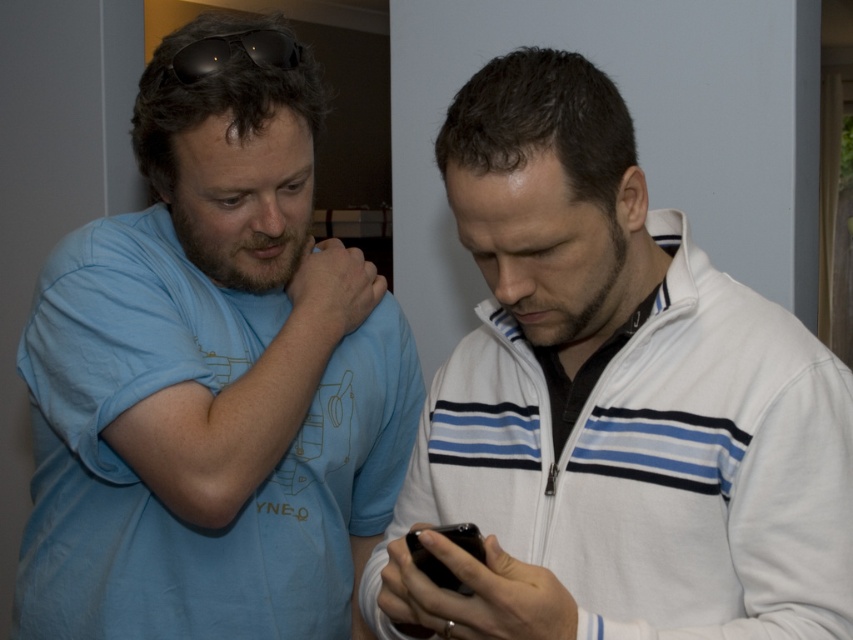
How far apart are white fleece jacket at center and light blue t-shirt at left?

13.91 inches

Is point (422, 483) less distant than point (123, 218)?

Yes, point (422, 483) is in front of point (123, 218).

Does point (393, 636) come closer to viewer compared to point (68, 246)?

Yes, point (393, 636) is in front of point (68, 246).

Find the location of `white fleece jacket at center`. white fleece jacket at center is located at coordinates (612, 403).

Who is lower down, light blue t-shirt at left or black matte sunglasses at upper center?

Positioned lower is light blue t-shirt at left.

In the scene shown: Is light blue t-shirt at left shorter than black matte sunglasses at upper center?

In fact, light blue t-shirt at left may be taller than black matte sunglasses at upper center.

Which is behind, point (202, 481) or point (206, 48)?

The point (206, 48) is behind.

Find the location of a particular element. The width and height of the screenshot is (853, 640). light blue t-shirt at left is located at coordinates (212, 381).

Can you confirm if white fleece jacket at center is positioned to the right of black matte sunglasses at upper center?

Yes, white fleece jacket at center is to the right of black matte sunglasses at upper center.

Which is in front, point (506, 410) or point (212, 44)?

Point (506, 410) is more forward.

The height and width of the screenshot is (640, 853). What do you see at coordinates (612, 403) in the screenshot?
I see `white fleece jacket at center` at bounding box center [612, 403].

This screenshot has width=853, height=640. I want to click on white fleece jacket at center, so click(612, 403).